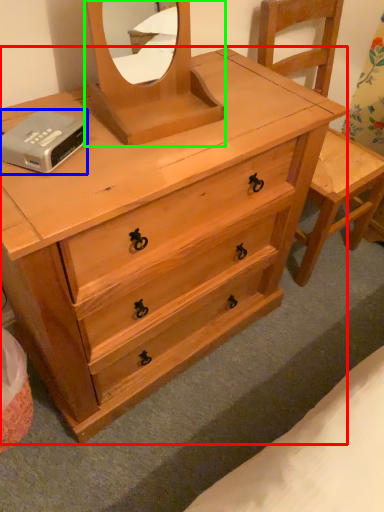
Question: Estimate the real-world distances between objects in this image. Which object is closer to chest of drawers (highlighted by a red box), hardware (highlighted by a blue box) or mirror (highlighted by a green box)?

Choices:
 (A) hardware
 (B) mirror

Answer: (B)